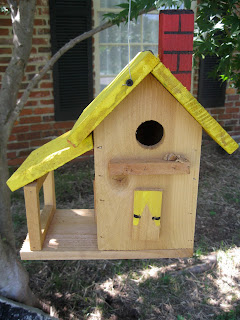
Where is `yellow painted wood`? yellow painted wood is located at coordinates (54, 152), (153, 195), (138, 72), (186, 96).